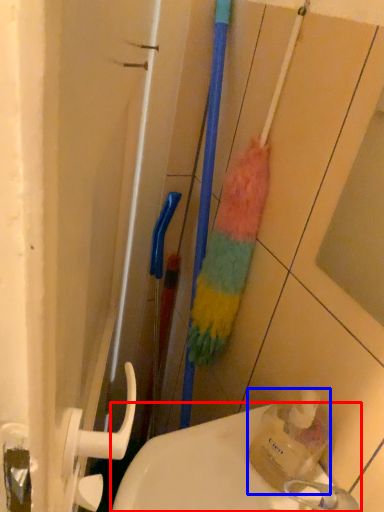
Question: Which object is closer to the camera taking this photo, sink (highlighted by a red box) or bottle (highlighted by a blue box)?

Choices:
 (A) sink
 (B) bottle

Answer: (A)